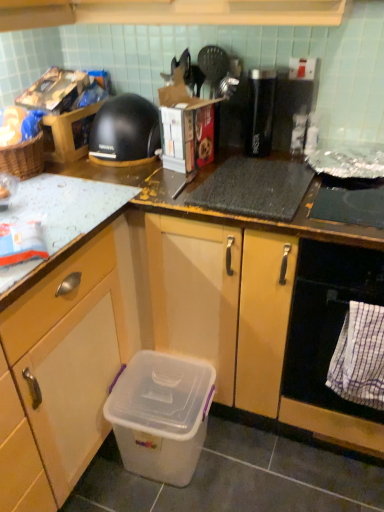
Question: Would you say black plastic toaster at upper right, marked as the first appliance in a right-to-left arrangement, is inside or outside matte plastic container at lower center?

Choices:
 (A) outside
 (B) inside

Answer: (A)

Question: Relative to matte plastic container at lower center, is black plastic toaster at upper right, which ranks as the second appliance in left-to-right order, in front or behind?

Choices:
 (A) behind
 (B) front

Answer: (A)

Question: Considering the real-world distances, which object is farthest from the black plastic toaster at upper right, which ranks as the second appliance in left-to-right order?

Choices:
 (A) white checkered towel at lower right
 (B) black glossy thermos at upper center, which appears as the 2th appliance when viewed from the right
 (C) matte plastic container at lower center
 (D) transparent plastic storage box at lower left
 (E) black matte oven at lower right

Answer: (D)

Question: Estimate the real-world distances between objects in this image. Which object is farther from the black matte coffee maker at upper left?

Choices:
 (A) matte plastic container at lower center
 (B) white checkered towel at lower right
 (C) black matte oven at lower right
 (D) transparent plastic storage box at lower left
 (E) black plastic toaster at upper right, marked as the first appliance in a right-to-left arrangement

Answer: (B)